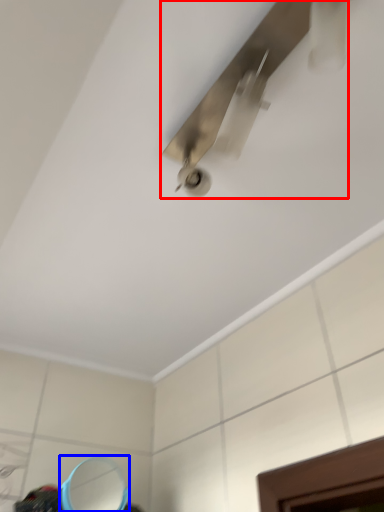
Question: Which object appears closest to the camera in this image, ceiling fan (highlighted by a red box) or mirror (highlighted by a blue box)?

Choices:
 (A) ceiling fan
 (B) mirror

Answer: (A)